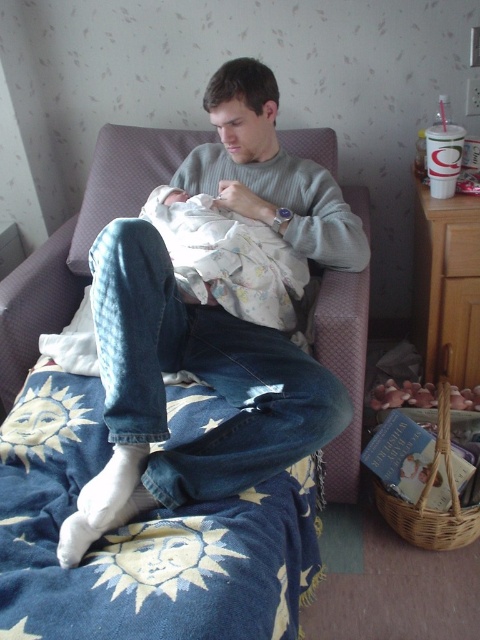
Question: Does denim jeans at center have a greater width compared to floral cotton blanket at center?

Choices:
 (A) no
 (B) yes

Answer: (B)

Question: Can you confirm if blue embroidered blanket at lower left is thinner than floral cotton blanket at center?

Choices:
 (A) no
 (B) yes

Answer: (A)

Question: Which point is farther to the camera?

Choices:
 (A) denim jeans at center
 (B) blue embroidered blanket at lower left

Answer: (A)

Question: In this image, where is blue embroidered blanket at lower left located relative to denim jeans at center?

Choices:
 (A) left
 (B) right

Answer: (A)

Question: Among these objects, which one is farthest from the camera?

Choices:
 (A) floral cotton blanket at center
 (B) denim jeans at center
 (C) blue embroidered blanket at lower left

Answer: (A)

Question: Which object appears farthest from the camera in this image?

Choices:
 (A) blue embroidered blanket at lower left
 (B) floral cotton blanket at center
 (C) denim jeans at center

Answer: (B)